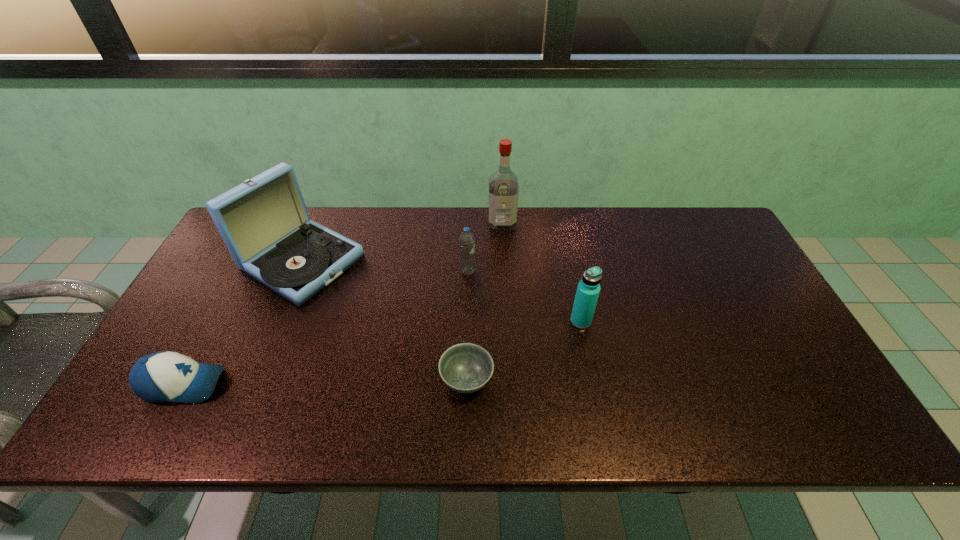
I want to click on liquor, so click(503, 184).

Where is `phonograph record`? Image resolution: width=960 pixels, height=540 pixels. phonograph record is located at coordinates (264, 222).

Identify the location of the third nearest object. (588, 289).

Where is `the nearer water bottle`? This screenshot has height=540, width=960. the nearer water bottle is located at coordinates (588, 289).

Find the location of a particular element. This screenshot has width=960, height=540. the shorter water bottle is located at coordinates (466, 240).

Image resolution: width=960 pixels, height=540 pixels. Find the location of `the left water bottle`. the left water bottle is located at coordinates (466, 240).

What are the coordinates of `the second shortest object` in the screenshot? It's located at (166, 376).

Locate an element on the screen. This screenshot has width=960, height=540. the shortest object is located at coordinates pyautogui.click(x=466, y=368).

Find the location of a particular element. This screenshot has height=540, width=960. blank area located 0.200m on the front-facing side of the liquor is located at coordinates (505, 275).

I want to click on free space located on the right of the phonograph record, so click(455, 262).